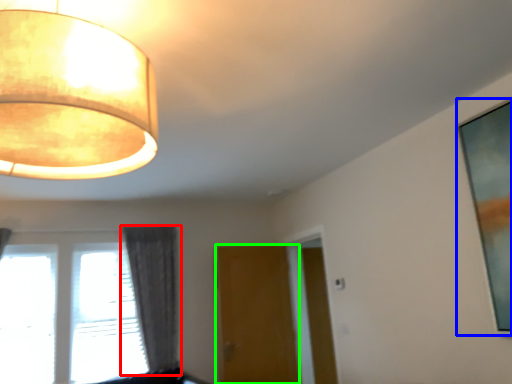
Question: Based on their relative distances, which object is nearer to curtain (highlighted by a red box)? Choose from picture frame (highlighted by a blue box) and door (highlighted by a green box).

Choices:
 (A) picture frame
 (B) door

Answer: (B)